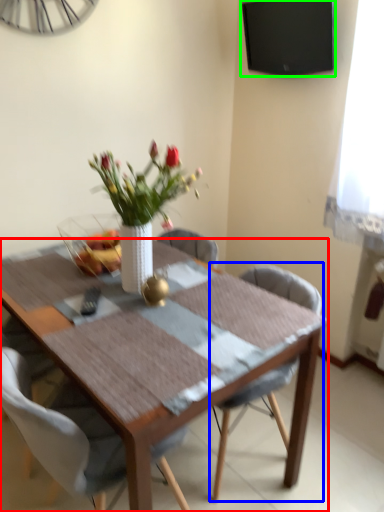
Question: Which object is the closest to the kitchen & dining room table (highlighted by a red box)? Choose among these: chair (highlighted by a blue box) or television (highlighted by a green box).

Choices:
 (A) chair
 (B) television

Answer: (A)